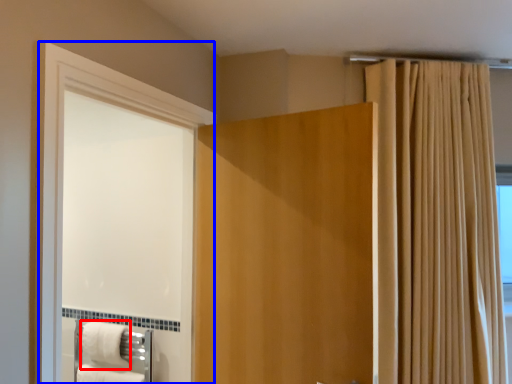
Question: Which point is closer to the camera, bath towel (highlighted by a red box) or screen door (highlighted by a blue box)?

Choices:
 (A) bath towel
 (B) screen door

Answer: (B)